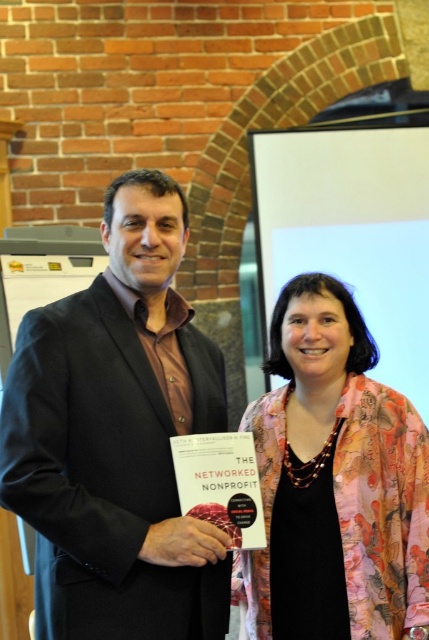
Question: Can you confirm if black matte suit at left is thinner than floral silk jacket at center?

Choices:
 (A) no
 (B) yes

Answer: (A)

Question: Can you confirm if black matte suit at left is wider than floral silk jacket at center?

Choices:
 (A) no
 (B) yes

Answer: (B)

Question: Does black matte suit at left appear on the right side of floral silk jacket at center?

Choices:
 (A) no
 (B) yes

Answer: (A)